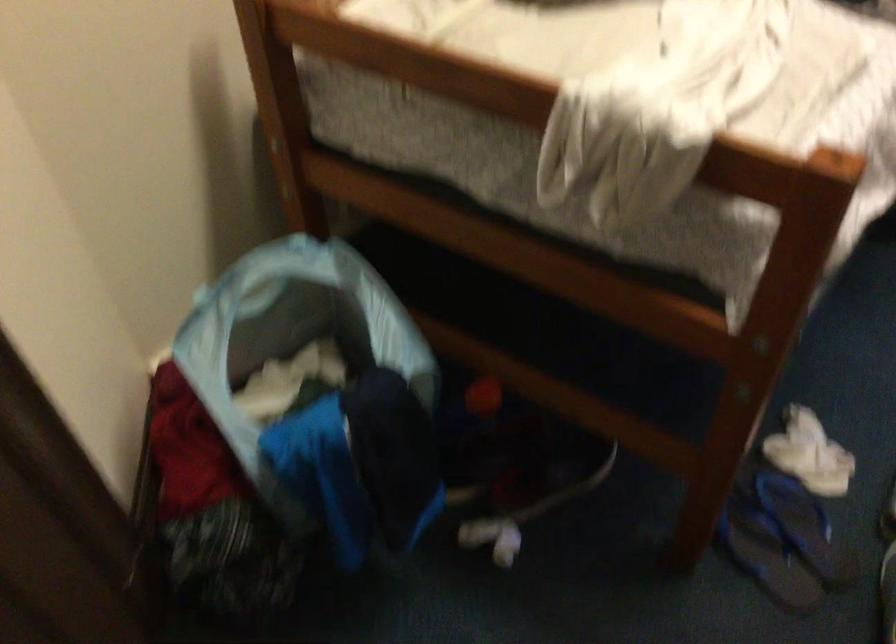
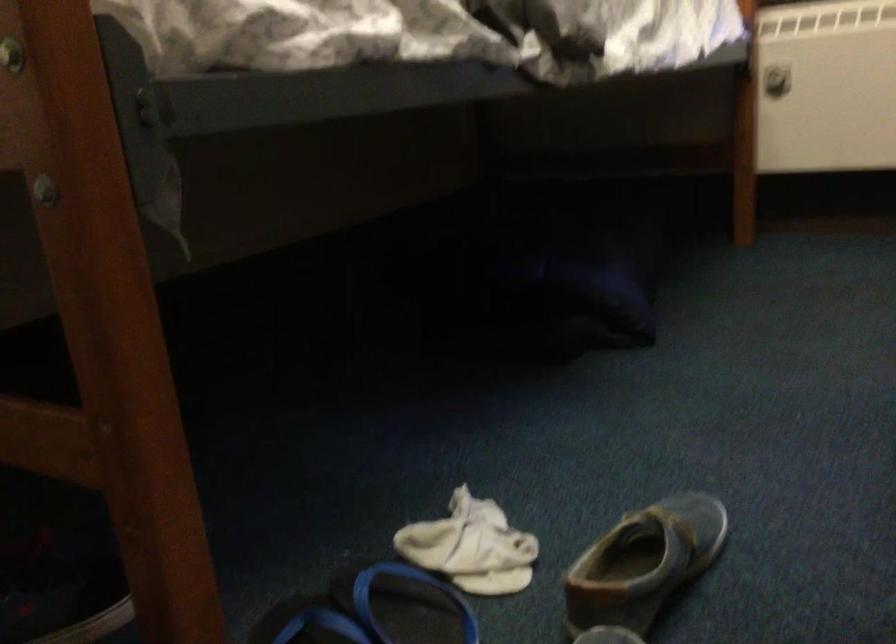
Where in the second image is the point corresponding to (x=780, y=500) from the first image?

(406, 605)